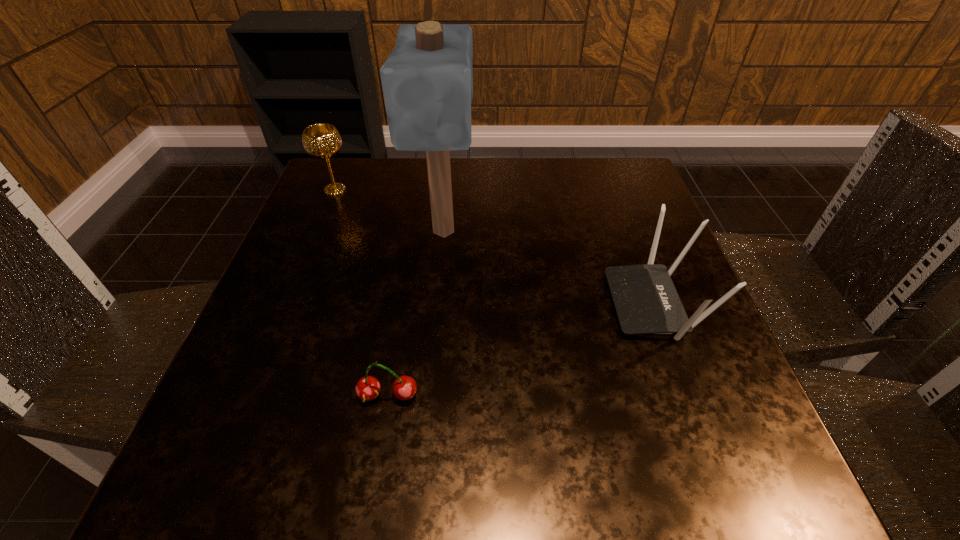
In the image, there is a desktop. Where is `vacant space at the right edge`? This screenshot has height=540, width=960. vacant space at the right edge is located at coordinates (652, 342).

Locate an element on the screen. The image size is (960, 540). vacant space at the far left corner of the desktop is located at coordinates (360, 161).

At what (x,y) coordinates should I click in order to perform the action: click on vacant space at the near left corner of the desktop. Please return your answer as a coordinate pair (x, y). The height and width of the screenshot is (540, 960). Looking at the image, I should click on (204, 493).

Where is `blank space at the far right corner of the desktop`? The image size is (960, 540). blank space at the far right corner of the desktop is located at coordinates (642, 188).

In the image, there is a desktop. Identify the location of vacant space at the near right corner. (723, 433).

Image resolution: width=960 pixels, height=540 pixels. What are the coordinates of `free point between the nearest object and the mallet` in the screenshot? It's located at (416, 314).

The height and width of the screenshot is (540, 960). Identify the location of free spot between the router and the chalice. (495, 247).

Identify the location of empty space that is in between the tallest object and the nearest object. (416, 314).

Where is `free area in between the tallest object and the nearest object`? This screenshot has height=540, width=960. free area in between the tallest object and the nearest object is located at coordinates 416,314.

The height and width of the screenshot is (540, 960). What are the coordinates of `free point between the router and the nearest object` in the screenshot? It's located at (521, 350).